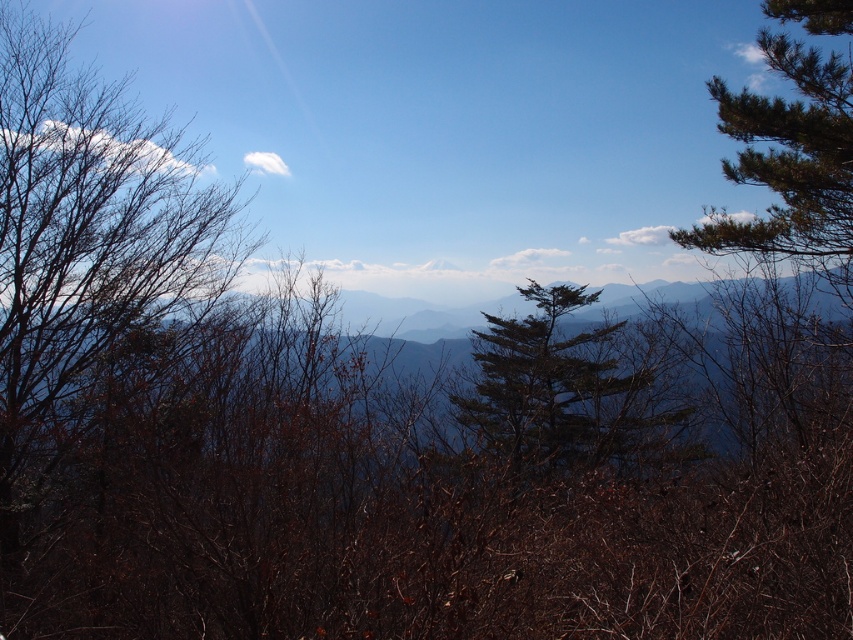
Question: Can you confirm if green needle-like tree at upper right is wider than green needle-like tree at center?

Choices:
 (A) yes
 (B) no

Answer: (B)

Question: Which point is closer to the camera?

Choices:
 (A) green needle-like tree at center
 (B) green needle-like tree at upper right

Answer: (A)

Question: Among these points, which one is farthest from the camera?

Choices:
 (A) (704, 234)
 (B) (531, 470)

Answer: (B)

Question: Among these points, which one is nearest to the camera?

Choices:
 (A) (490, 346)
 (B) (790, 77)

Answer: (B)

Question: Is green needle-like tree at upper right further to camera compared to green needle-like tree at center?

Choices:
 (A) yes
 (B) no

Answer: (A)

Question: From the image, what is the correct spatial relationship of green needle-like tree at upper right in relation to green needle-like tree at center?

Choices:
 (A) left
 (B) right

Answer: (B)